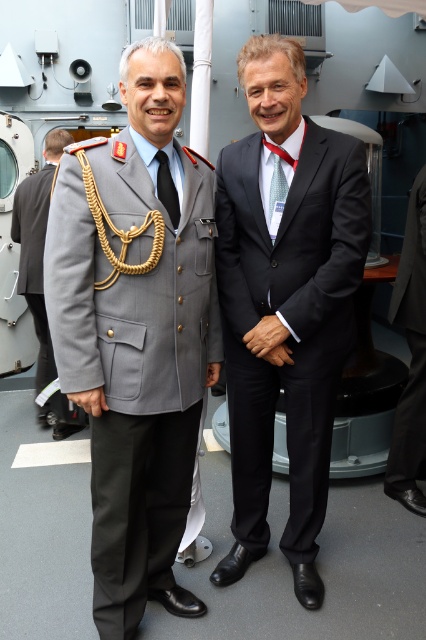
Who is positioned more to the right, matte gray uniform at center or matte black suit at center?

Positioned to the right is matte gray uniform at center.

Does point (189, 305) come behind point (129, 538)?

No, it is not.

The width and height of the screenshot is (426, 640). What are the coordinates of `matte gray uniform at center` in the screenshot? It's located at (132, 333).

Based on the photo, can you confirm if matte gray uniform at center is positioned to the right of gray wool military uniform at center?

Indeed, matte gray uniform at center is positioned on the right side of gray wool military uniform at center.

Describe the element at coordinates (132, 333) in the screenshot. The height and width of the screenshot is (640, 426). I see `matte gray uniform at center` at that location.

What are the coordinates of `matte gray uniform at center` in the screenshot? It's located at (132, 333).

How distant is black smooth suit at right from gray wool military uniform at center?

black smooth suit at right and gray wool military uniform at center are 6.39 feet apart.

Who is shorter, black smooth suit at right or gray wool military uniform at center?

black smooth suit at right is shorter.

Image resolution: width=426 pixels, height=640 pixels. I want to click on black smooth suit at right, so click(411, 349).

Where is `black smooth suit at right`? The height and width of the screenshot is (640, 426). black smooth suit at right is located at coordinates (411, 349).